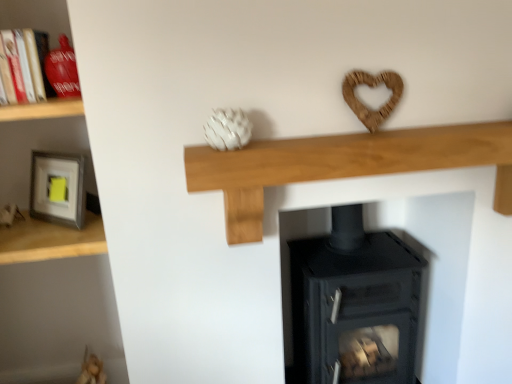
Locate an element on the screen. The image size is (512, 384). free space above natural wood mantle at center, placed as the 4th shelf when sorted from left to right (from a real-world perspective) is located at coordinates (362, 129).